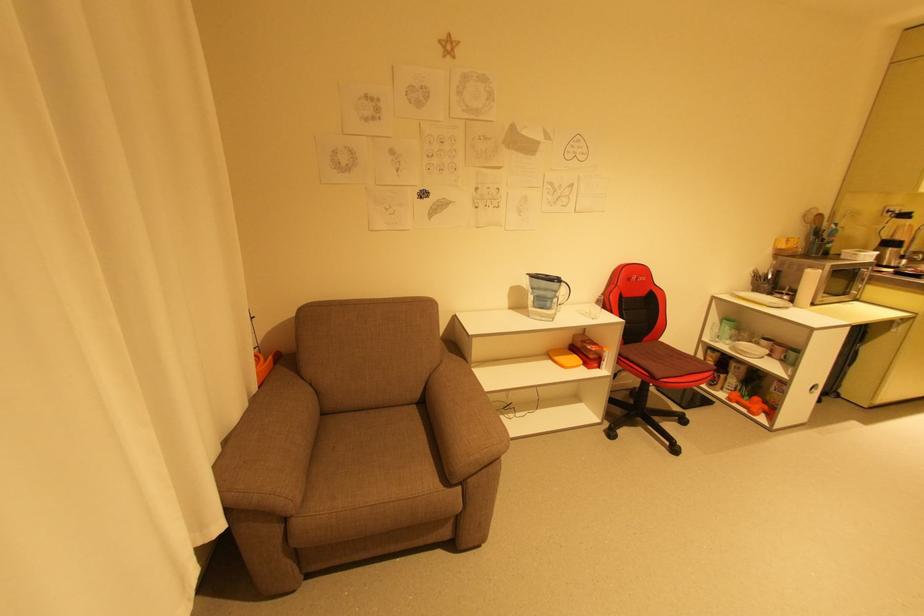
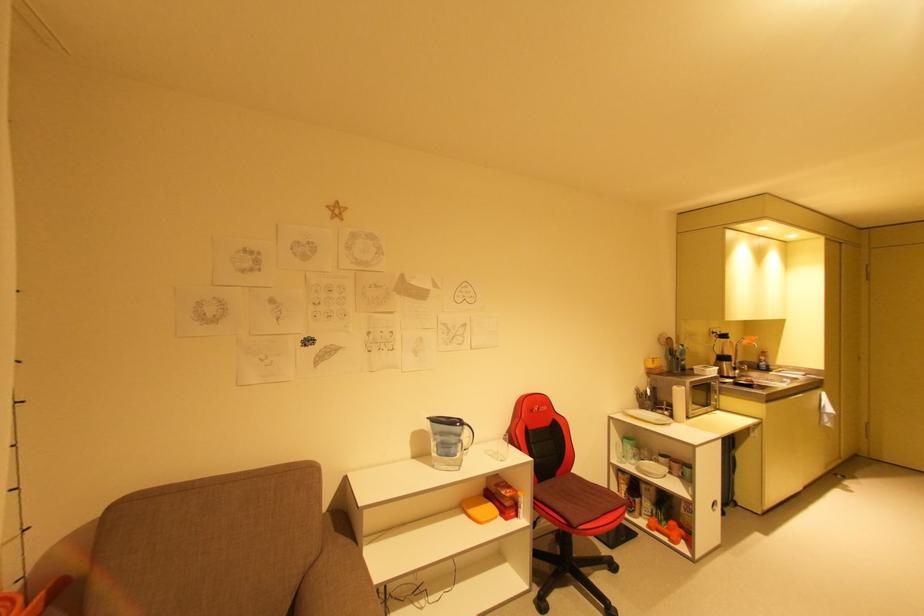
Locate, in the second image, the point that corresponds to the point at 567,284 in the first image.

(469, 427)